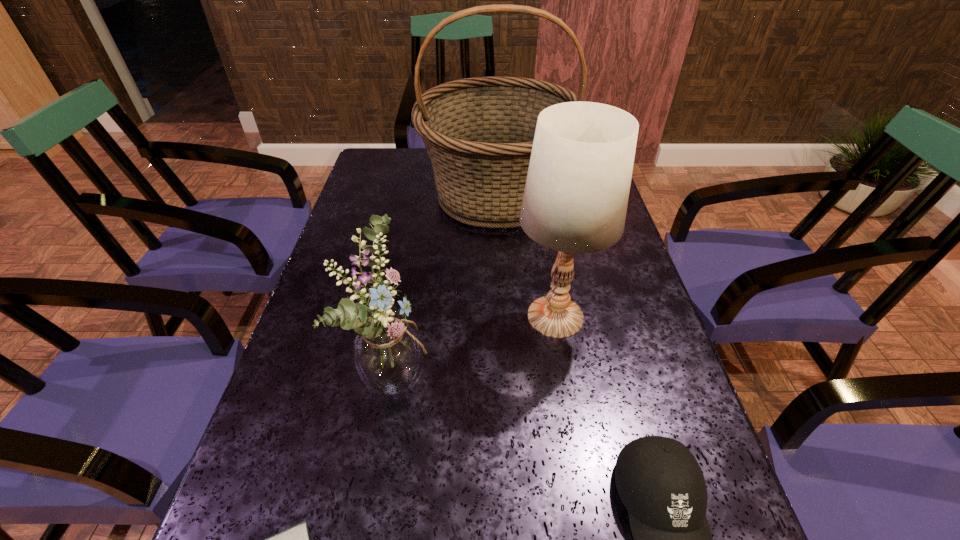
The width and height of the screenshot is (960, 540). In order to click on basket in this screenshot , I will do `click(479, 132)`.

Find the location of a particular element. This screenshot has width=960, height=540. lamp is located at coordinates (576, 194).

The width and height of the screenshot is (960, 540). I want to click on bouquet, so click(x=387, y=351).

The width and height of the screenshot is (960, 540). I want to click on free space located 0.280m on the front of the basket, so click(504, 321).

At what (x,y) coordinates should I click in order to perform the action: click on free location located 0.190m on the left of the lamp. Please return your answer as a coordinate pair (x, y). Looking at the image, I should click on (428, 317).

At what (x,y) coordinates should I click in order to perform the action: click on free point located on the front-facing side of the third shortest object. Please return your answer as a coordinate pair (x, y). Looking at the image, I should click on (512, 372).

The image size is (960, 540). I want to click on object located in the far edge section of the desktop, so click(x=479, y=132).

I want to click on object that is at the left edge, so click(x=387, y=351).

Locate an element on the screen. basket present at the right edge is located at coordinates point(479,132).

What are the coordinates of `lamp positioned at the right edge` in the screenshot? It's located at (576, 194).